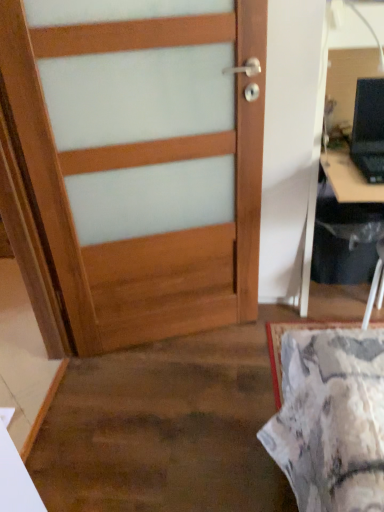
This screenshot has height=512, width=384. Identify the location of vacant region in front of wooden door at center. (169, 445).